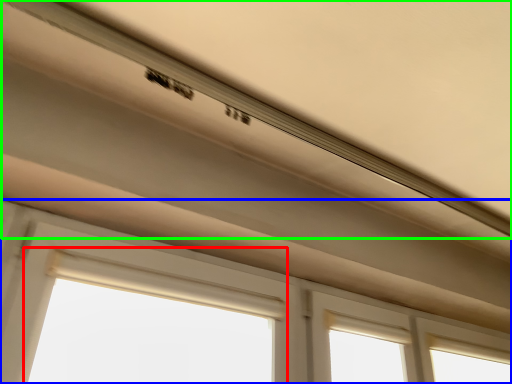
Question: Which is nearer to the bay window (highlighted by a red box)? window (highlighted by a blue box) or exhaust hood (highlighted by a green box).

Choices:
 (A) window
 (B) exhaust hood

Answer: (A)